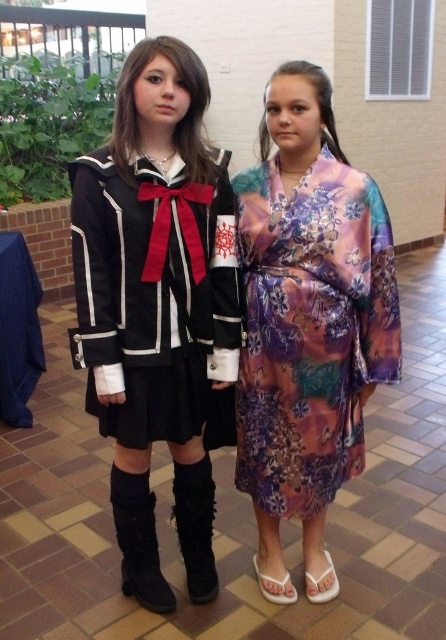
You are at an indoor event and see two people wearing the satin black dress at center and the floral silk kimono at center. Which one is standing to the left?

The satin black dress at center is positioned on the left side of the floral silk kimono at center, so the person wearing the satin black dress at center is standing to the left.

You are at an indoor event and see two people. One is wearing a black outfit with white trim on the left, and the other is at point (156, 307). Which person is wearing a satin black dress?

The person at point (156, 307) is wearing the satin black dress at center.

You are a photographer setting up a shoot in this indoor atrium. You need to position a light source so that it illuminates both the floral silk kimono at center and the black suede boot at lower left without casting shadows on the blue tablecloth in the background. Based on their positions, where should you place the light source relative to these two objects?

The light source should be placed above the floral silk kimono at center and the black suede boot at lower left to avoid casting shadows on the blue tablecloth in the background, as the floral silk kimono at center is located above the black suede boot at lower left.